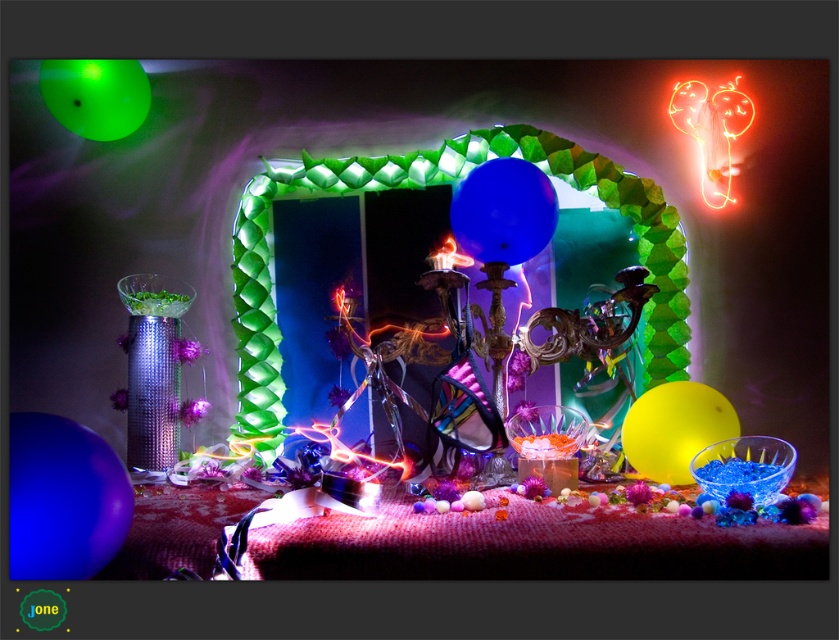
You are planning to hang a string of fairy lights between the yellow matte balloon at center and the green translucent balloon at upper left. The string is 7 feet long. Will the fairy lights reach between the two balloons?

The yellow matte balloon at center is 7.19 feet from the green translucent balloon at upper left. Since the fairy lights are only 7 feet long, they will be 0.19 feet short and won